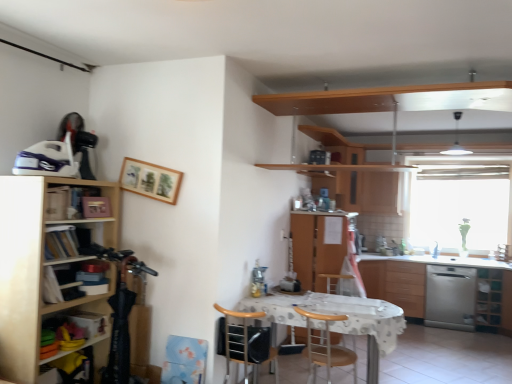
What do you see at coordinates (318, 246) in the screenshot? I see `wooden cabinet at center, which is the second cabinetry in back-to-front order` at bounding box center [318, 246].

This screenshot has width=512, height=384. Find the location of `wooden cabinet at center, which is counted as the second cabinetry, starting from the front`. wooden cabinet at center, which is counted as the second cabinetry, starting from the front is located at coordinates (318, 246).

You are a GUI agent. You are given a task and a screenshot of the screen. Output one action in this format:
    pyautogui.click(x=<x>, y=<y>)
    Task: Click on the wooden picture frame at upper center
    This screenshot has height=384, width=512.
    Given the screenshot: What is the action you would take?
    pos(150,180)

Locate an element on the screen. The width and height of the screenshot is (512, 384). brown wood chair at center, marked as the first chair in a right-to-left arrangement is located at coordinates (325, 347).

At what (x,y) coordinates should I click in order to perform the action: click on wooden cabinet at center, which is counted as the second cabinetry, starting from the front. Please return your answer as a coordinate pair (x, y). Image resolution: width=512 pixels, height=384 pixels. Looking at the image, I should click on point(318,246).

Is wooden cabinet at left, which is counted as the first cabinet, starting from the top, positioned with its back to transparent glass window at right?

wooden cabinet at left, which is counted as the first cabinet, starting from the top, does not have its back to transparent glass window at right.

Identify the location of window that is below the wooden cabinet at left, placed as the 2th cabinet when sorted from bottom to top (from the image's perspective). (460, 201).

Considering the sizes of wooden cabinet at left, the 1th cabinet in the front-to-back sequence, and transparent glass window at right in the image, is wooden cabinet at left, the 1th cabinet in the front-to-back sequence, taller or shorter than transparent glass window at right?

Clearly, wooden cabinet at left, the 1th cabinet in the front-to-back sequence, is shorter compared to transparent glass window at right.

From a real-world perspective, is wooden cabinet at left, arranged as the 2th cabinet when viewed from the back, over transparent glass window at right?

No.

What are the coordinates of `chair that is the 1st one when counting leftward from the white lace tablecloth at center` in the screenshot? It's located at pos(325,347).

Is point (346, 363) positioned behind point (320, 309)?

Yes, point (346, 363) is farther from viewer.

Between brown wood chair at center, marked as the first chair in a right-to-left arrangement, and white lace tablecloth at center, which one is positioned behind?

white lace tablecloth at center is more distant.

How different are the orientations of brown wood chair at center, the 2th chair from the left, and white lace tablecloth at center in degrees?

180 degrees separate the facing orientations of brown wood chair at center, the 2th chair from the left, and white lace tablecloth at center.

Consider the image. Which is more to the left, wooden picture frame at upper center or wooden books at left?

A: wooden books at left is more to the left.

Is wooden picture frame at upper center taller than wooden books at left?

Indeed, wooden picture frame at upper center has a greater height compared to wooden books at left.

Is point (147, 169) positioned before point (45, 227)?

No.

Where is `picture frame located on the right of wooden books at left`? Image resolution: width=512 pixels, height=384 pixels. picture frame located on the right of wooden books at left is located at coordinates (150, 180).

Is green glass cabinet at lower right, the second cabinet from the left, shorter than wooden picture frame at upper center?

In fact, green glass cabinet at lower right, the second cabinet from the left, may be taller than wooden picture frame at upper center.

Between green glass cabinet at lower right, the 2th cabinet when ordered from top to bottom, and wooden picture frame at upper center, which one has larger width?

Wider between the two is green glass cabinet at lower right, the 2th cabinet when ordered from top to bottom.

From a real-world perspective, which is physically above, green glass cabinet at lower right, the second cabinet from the left, or wooden picture frame at upper center?

wooden picture frame at upper center is physically above.

Locate an element on the screen. The image size is (512, 384). picture frame positioned vertically above the green glass cabinet at lower right, the 1th cabinet when ordered from back to front (from a real-world perspective) is located at coordinates (150, 180).

Could you tell me if brown wood chair at center, the 2th chair from the left, is turned towards wooden cabinet at left, arranged as the 2th cabinet when viewed from the back?

No, brown wood chair at center, the 2th chair from the left, is not aimed at wooden cabinet at left, arranged as the 2th cabinet when viewed from the back.

From the image's perspective, would you say brown wood chair at center, the 2th chair from the left, is positioned over wooden cabinet at left, the 2th cabinet positioned from the right?

No, from the image's perspective, brown wood chair at center, the 2th chair from the left, is not over wooden cabinet at left, the 2th cabinet positioned from the right.

Considering the relative positions of brown wood chair at center, the 2th chair from the left, and wooden cabinet at left, marked as the first cabinet in a left-to-right arrangement, in the image provided, is brown wood chair at center, the 2th chair from the left, to the right of wooden cabinet at left, marked as the first cabinet in a left-to-right arrangement, from the viewer's perspective?

Yes.

Considering the sizes of objects light wood cabinet at left, marked as the first cabinetry in a front-to-back arrangement, and brown wood chair at center, the 2th chair from the left, in the image provided, who is shorter, light wood cabinet at left, marked as the first cabinetry in a front-to-back arrangement, or brown wood chair at center, the 2th chair from the left,?

With less height is brown wood chair at center, the 2th chair from the left.

Is light wood cabinet at left, the 3th cabinetry from the back, aimed at brown wood chair at center, the 2th chair from the left?

No, light wood cabinet at left, the 3th cabinetry from the back, is not facing towards brown wood chair at center, the 2th chair from the left.

From the image's perspective, count 2nd cabinetrys upward from the brown wood chair at center, marked as the first chair in a right-to-left arrangement, and point to it. Please provide its 2D coordinates.

[(39, 268)]

Consider the image. What's the angular difference between light wood cabinet at left, positioned as the third cabinetry in right-to-left order, and brown wood chair at center, the 2th chair from the left,'s facing directions?

89.7 degrees separate the facing orientations of light wood cabinet at left, positioned as the third cabinetry in right-to-left order, and brown wood chair at center, the 2th chair from the left.

What's the angular difference between white lace tablecloth at center and transparent glass window at right's facing directions?

white lace tablecloth at center and transparent glass window at right are facing 0.661 degrees away from each other.

Would you say white lace tablecloth at center is to the left or to the right of transparent glass window at right in the picture?

In the image, white lace tablecloth at center appears on the left side of transparent glass window at right.

Is point (392, 321) closer to camera compared to point (411, 229)?

Yes, point (392, 321) is in front of point (411, 229).

Measure the distance from white lace tablecloth at center to transparent glass window at right.

white lace tablecloth at center and transparent glass window at right are 9.79 feet apart from each other.

Locate an element on the screen. Image resolution: width=512 pixels, height=384 pixels. the 1st cabinet located beneath the transparent glass window at right (from a real-world perspective) is located at coordinates (74, 202).

Locate an element on the screen. The width and height of the screenshot is (512, 384). kitchen & dining room table that is behind the brown wood chair at center, the 2th chair from the left is located at coordinates (339, 322).

Based on the photo, which object lies nearer to the anchor point wooden picture frame at upper center, light wood cabinet at left, the 3th cabinetry from the back, or stainless steel dishwasher at right?

light wood cabinet at left, the 3th cabinetry from the back, is positioned closer to the anchor wooden picture frame at upper center.

Which object lies nearer to the anchor point wooden cabinet at center, which is counted as the second cabinetry, starting from the front, wooden cabinet at left, the 2th cabinet positioned from the right, or wooden chair at center, which is counted as the 1th chair, starting from the left?

wooden chair at center, which is counted as the 1th chair, starting from the left, is closer to wooden cabinet at center, which is counted as the second cabinetry, starting from the front.

Looking at the image, which one is located further to wooden cabinet at center, the second cabinetry when ordered from left to right, light wood cabinet at left, marked as the first cabinetry in a front-to-back arrangement, or wooden picture frame at upper center?

light wood cabinet at left, marked as the first cabinetry in a front-to-back arrangement, is positioned further to the anchor wooden cabinet at center, the second cabinetry when ordered from left to right.

Based on their spatial positions, is wooden picture frame at upper center or wooden chair at center, which is counted as the 1th chair, starting from the left, closer to light wood cabinet at left, which is counted as the first cabinetry, starting from the left?

wooden picture frame at upper center is positioned closer to the anchor light wood cabinet at left, which is counted as the first cabinetry, starting from the left.

Considering their positions, is brown wood cabinet at right, marked as the 1th cabinetry in a back-to-front arrangement, positioned further to brown wood chair at center, marked as the first chair in a right-to-left arrangement, than wooden books at left?

The object further to brown wood chair at center, marked as the first chair in a right-to-left arrangement, is wooden books at left.

When comparing their distances from wooden books at left, does wooden picture frame at upper center or brown wood cabinet at right, the 3th cabinetry when ordered from front to back, seem further?

The object further to wooden books at left is brown wood cabinet at right, the 3th cabinetry when ordered from front to back.

Based on their spatial positions, is wooden cabinet at left, the 1th cabinet in the front-to-back sequence, or transparent glass window at right further from brown wood cabinet at right, the 3th cabinetry when ordered from front to back?

The object further to brown wood cabinet at right, the 3th cabinetry when ordered from front to back, is wooden cabinet at left, the 1th cabinet in the front-to-back sequence.

When comparing their distances from stainless steel dishwasher at right, does brown wood cabinet at right, marked as the 1th cabinetry in a back-to-front arrangement, or light wood cabinet at left, marked as the first cabinetry in a front-to-back arrangement, seem closer?

brown wood cabinet at right, marked as the 1th cabinetry in a back-to-front arrangement.

The image size is (512, 384). What are the coordinates of `kitchen & dining room table between wooden cabinet at left, which is counted as the first cabinet, starting from the top, and wooden cabinet at center, the second cabinetry when ordered from left to right` in the screenshot? It's located at (339, 322).

At what (x,y) coordinates should I click in order to perform the action: click on kitchen & dining room table located between light wood cabinet at left, positioned as the third cabinetry in right-to-left order, and green glass cabinet at lower right, positioned as the 1th cabinet in bottom-to-top order, in the left-right direction. Please return your answer as a coordinate pair (x, y). Image resolution: width=512 pixels, height=384 pixels. Looking at the image, I should click on (339, 322).

Identify the location of home appliance located between wooden chair at center, positioned as the 2th chair in right-to-left order, and brown wood cabinet at right, arranged as the third cabinetry when viewed from the left, in the depth direction. (x=450, y=297).

The image size is (512, 384). Identify the location of home appliance between transparent glass window at right and green glass cabinet at lower right, which appears as the 2th cabinet when viewed from the front, in the up-down direction. (450, 297).